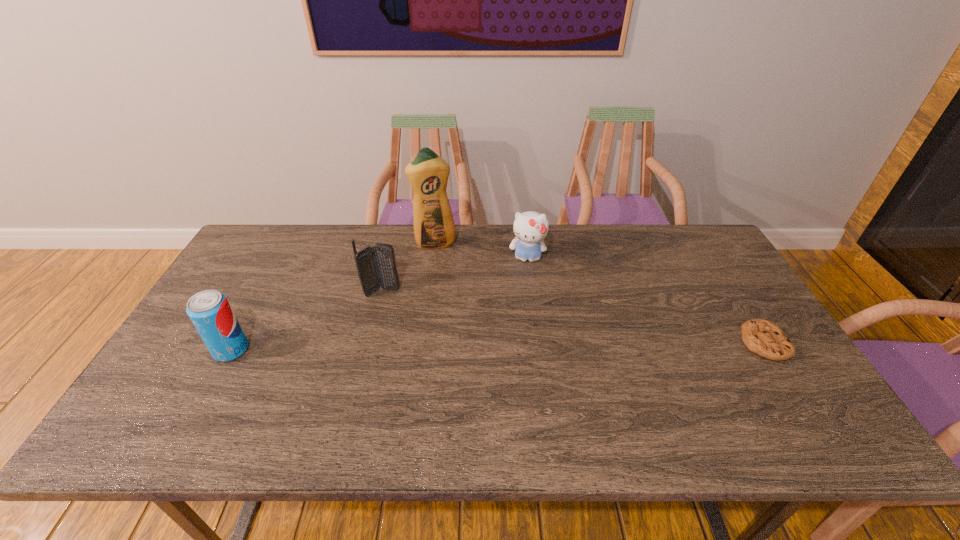
Where is `free space that is in between the shortest object and the fourth object from right to left`? free space that is in between the shortest object and the fourth object from right to left is located at coordinates (573, 317).

At what (x,y) coordinates should I click in order to perform the action: click on unoccupied position between the shortest object and the kitten. Please return your answer as a coordinate pair (x, y). Image resolution: width=960 pixels, height=540 pixels. Looking at the image, I should click on (645, 300).

You are a GUI agent. You are given a task and a screenshot of the screen. Output one action in this format:
    pyautogui.click(x=<x>, y=<y>)
    Task: Click on the empty location between the leftmost object and the rightmost object
    The height and width of the screenshot is (540, 960).
    Given the screenshot: What is the action you would take?
    pyautogui.click(x=497, y=346)

Identify the location of vacant space in between the kitten and the third object from left to right. Image resolution: width=960 pixels, height=540 pixels. (481, 251).

Where is `blank region between the kitten and the cellular telephone`? This screenshot has width=960, height=540. blank region between the kitten and the cellular telephone is located at coordinates (455, 275).

At what (x,y) coordinates should I click in order to perform the action: click on vacant area that lies between the fourth object from left to right and the detergent. Please return your answer as a coordinate pair (x, y). Looking at the image, I should click on (481, 251).

Find the location of a particular element. empty space that is in between the detergent and the cellular telephone is located at coordinates (408, 268).

Find the location of a particular element. The height and width of the screenshot is (540, 960). free spot between the shortest object and the tallest object is located at coordinates (599, 293).

Image resolution: width=960 pixels, height=540 pixels. What are the coordinates of `the closest object to the second object from left to right` in the screenshot? It's located at (434, 228).

Point out which object is positioned as the nearest to the third farthest object. Please provide its 2D coordinates. Your answer should be formatted as a tuple, i.e. [(x, y)], where the tuple contains the x and y coordinates of a point satisfying the conditions above.

[(434, 228)]